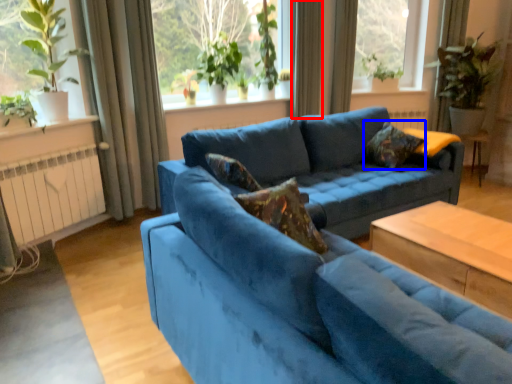
Question: Which object is further to the camera taking this photo, curtain (highlighted by a red box) or pillow (highlighted by a blue box)?

Choices:
 (A) curtain
 (B) pillow

Answer: (A)